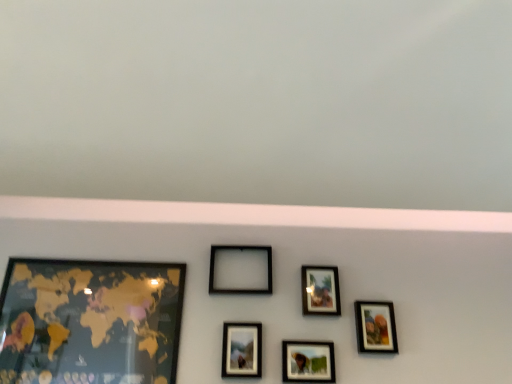
Question: Is matte black picture frame at upper center, the fifth picture frame viewed from the left, taller or shorter than matte glass photo frame at center, which appears as the fourth picture frame when viewed from the right?

Choices:
 (A) tall
 (B) short

Answer: (A)

Question: Looking at their shapes, would you say matte black picture frame at upper center, the 2th picture frame from the right, is wider or thinner than matte glass photo frame at center, which is counted as the 3th picture frame, starting from the left?

Choices:
 (A) thin
 (B) wide

Answer: (A)

Question: Estimate the real-world distances between objects in this image. Which object is closer to the matte black picture frame at center, which appears as the third picture frame when viewed from the right?

Choices:
 (A) gold matte map at left, arranged as the 1th picture frame when viewed from the left
 (B) matte black picture frame at upper center, the fifth picture frame viewed from the left
 (C) matte black picture frame at lower right, which ranks as the 6th picture frame in left-to-right order
 (D) matte glass photo frame at center, which is counted as the 3th picture frame, starting from the left
 (E) black matte picture frame at center, which is the 2th picture frame from left to right

Answer: (D)

Question: Which is farther from the matte black picture frame at lower right, which ranks as the 6th picture frame in left-to-right order?

Choices:
 (A) matte glass photo frame at center, which is counted as the 3th picture frame, starting from the left
 (B) gold matte map at left, arranged as the 1th picture frame when viewed from the left
 (C) matte black picture frame at upper center, the fifth picture frame viewed from the left
 (D) matte black picture frame at center, placed as the fourth picture frame when sorted from left to right
 (E) black matte picture frame at center, positioned as the 5th picture frame in right-to-left order

Answer: (B)